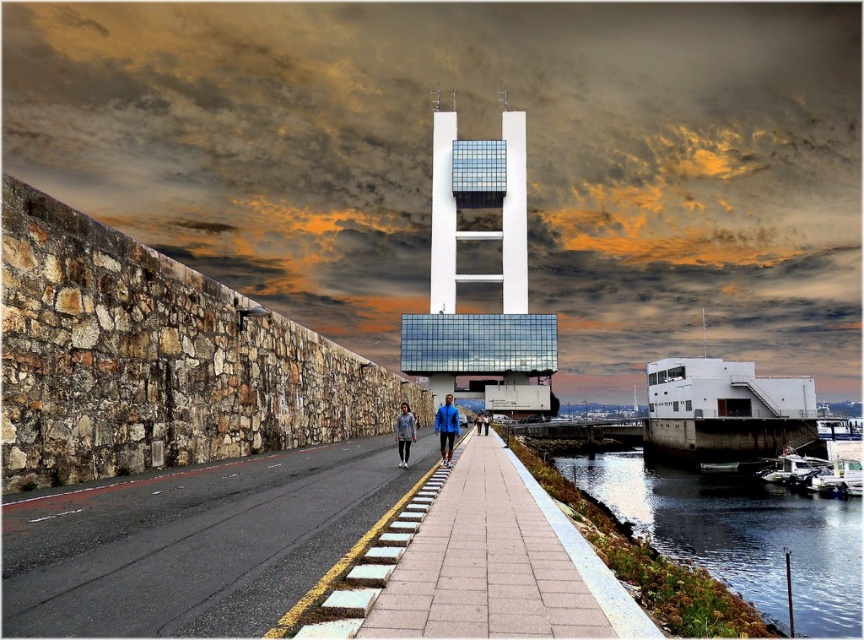
Question: Which point is closer to the camera?

Choices:
 (A) (442, 410)
 (B) (759, 547)
 (C) (583, 630)

Answer: (C)

Question: Is concrete paving at center above white glass building at center?

Choices:
 (A) yes
 (B) no

Answer: (B)

Question: Considering the relative positions of clear water at lower right and denim jacket at center in the image provided, where is clear water at lower right located with respect to denim jacket at center?

Choices:
 (A) above
 (B) below

Answer: (B)

Question: Which point appears closest to the camera in this image?

Choices:
 (A) click(x=7, y=627)
 (B) click(x=716, y=483)

Answer: (A)

Question: Can you confirm if paved stone sidewalk at center is positioned below white glass building at center?

Choices:
 (A) no
 (B) yes

Answer: (B)

Question: Among these points, which one is farthest from the camera?

Choices:
 (A) (414, 424)
 (B) (591, 595)
 (C) (454, 433)

Answer: (C)